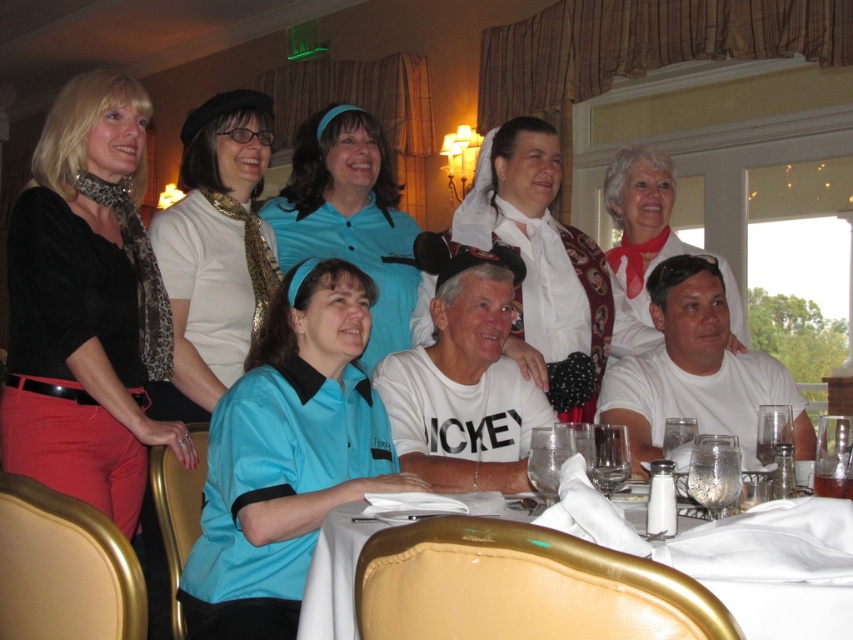
Question: Does matte blue shirt at center have a larger size compared to blue jersey at center?

Choices:
 (A) no
 (B) yes

Answer: (A)

Question: Is white cloth at lower center behind white satin dress at center?

Choices:
 (A) no
 (B) yes

Answer: (A)

Question: Which of the following is the farthest from the observer?

Choices:
 (A) (245, 580)
 (B) (614, 344)
 (C) (229, 230)
 (D) (502, 358)

Answer: (B)

Question: Which is farther from the blue jersey at center?

Choices:
 (A) white leopard print tie at upper left
 (B) white cloth at lower center
 (C) white satin dress at center
 (D) matte blue shirt at center

Answer: (B)

Question: Is white cloth at lower center bigger than blue jersey at center?

Choices:
 (A) yes
 (B) no

Answer: (B)

Question: Which object is farther from the camera taking this photo?

Choices:
 (A) white satin dress at center
 (B) white matte shirt at lower right
 (C) white cloth at lower center

Answer: (A)